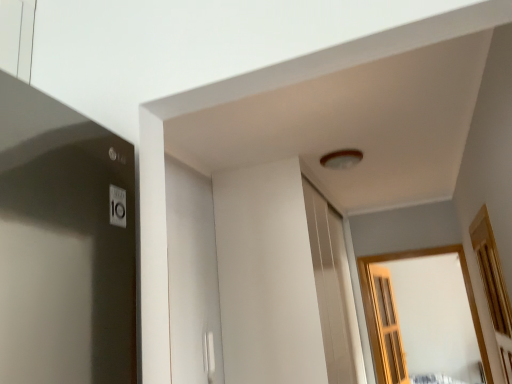
What do you see at coordinates (387, 325) in the screenshot? The height and width of the screenshot is (384, 512). I see `wooden screen door at right` at bounding box center [387, 325].

Identify the location of wooden screen door at right. (387, 325).

The image size is (512, 384). I want to click on wooden-framed window at center, which is the 1th window in back-to-front order, so click(377, 310).

This screenshot has height=384, width=512. What are the coordinates of `window that is the 1st object located in front of the wooden screen door at right` in the screenshot? It's located at pyautogui.click(x=377, y=310).

From a real-world perspective, is wooden screen door at right physically located above or below wooden-framed window at center, the 2th window positioned from the front?

wooden screen door at right is below wooden-framed window at center, the 2th window positioned from the front.

Which object is further away from the camera taking this photo, wooden screen door at right or wooden-framed window at center, the 2th window positioned from the front?

wooden screen door at right is behind.

From the image's perspective, which one is positioned higher, wooden at right, placed as the first window when sorted from front to back, or wooden screen door at right?

wooden at right, placed as the first window when sorted from front to back, from the image's perspective.

In the scene shown: From a real-world perspective, which object stands above the other?

wooden at right, placed as the first window when sorted from front to back, is physically above.

Considering the positions of objects wooden at right, the second window from the back, and wooden screen door at right in the image provided, who is behind, wooden at right, the second window from the back, or wooden screen door at right?

wooden screen door at right.

In the scene shown: Is wooden at right, placed as the first window when sorted from front to back, thinner than wooden screen door at right?

Yes.

In the scene shown: Can you confirm if wooden screen door at right is thinner than wooden at right, placed as the first window when sorted from front to back?

Incorrect, the width of wooden screen door at right is not less than that of wooden at right, placed as the first window when sorted from front to back.

From the image's perspective, is wooden screen door at right below wooden at right, placed as the first window when sorted from front to back?

Correct, wooden screen door at right appears lower than wooden at right, placed as the first window when sorted from front to back, in the image.

Locate an element on the screen. This screenshot has width=512, height=384. the 2nd window in front of the wooden screen door at right, counting from the anchor's position is located at coordinates (493, 287).

How many degrees apart are the facing directions of wooden screen door at right and wooden at right, the second window from the back?

wooden screen door at right and wooden at right, the second window from the back, are facing 171 degrees away from each other.

Between wooden at right, placed as the first window when sorted from front to back, and wooden-framed window at center, which is the 1th window in back-to-front order, which one is positioned in front?

wooden at right, placed as the first window when sorted from front to back, is closer to the camera.

From the picture: From a real-world perspective, who is located higher, wooden at right, placed as the first window when sorted from front to back, or wooden-framed window at center, which is the 1th window in back-to-front order?

wooden at right, placed as the first window when sorted from front to back, from a real-world perspective.

Based on their sizes in the image, would you say wooden at right, placed as the first window when sorted from front to back, is bigger or smaller than wooden-framed window at center, which is the 1th window in back-to-front order?

Clearly, wooden at right, placed as the first window when sorted from front to back, is smaller in size than wooden-framed window at center, which is the 1th window in back-to-front order.

Is wooden at right, placed as the first window when sorted from front to back, wider or thinner than wooden-framed window at center, which is the 1th window in back-to-front order?

In the image, wooden at right, placed as the first window when sorted from front to back, appears to be more narrow than wooden-framed window at center, which is the 1th window in back-to-front order.

Is wooden-framed window at center, the 2th window positioned from the front, inside or outside of wooden screen door at right?

wooden-framed window at center, the 2th window positioned from the front, lies outside wooden screen door at right.

Which of these two, wooden-framed window at center, the 2th window positioned from the front, or wooden screen door at right, is smaller?

wooden screen door at right.

In the scene shown: From the image's perspective, which is below, wooden-framed window at center, the 2th window positioned from the front, or wooden screen door at right?

wooden screen door at right, from the image's perspective.

Which point is more distant from viewer, (381, 356) or (374, 314)?

The point (374, 314) is more distant.

Can you confirm if wooden-framed window at center, the 2th window positioned from the front, is shorter than wooden at right, placed as the first window when sorted from front to back?

No.

From a real-world perspective, between wooden-framed window at center, the 2th window positioned from the front, and wooden at right, the second window from the back, who is vertically higher?

wooden at right, the second window from the back, is physically above.

Is wooden-framed window at center, which is the 1th window in back-to-front order, at the left side of wooden at right, the second window from the back?

Incorrect, wooden-framed window at center, which is the 1th window in back-to-front order, is not on the left side of wooden at right, the second window from the back.

Looking at this image, is wooden-framed window at center, which is the 1th window in back-to-front order, in front of or behind wooden at right, placed as the first window when sorted from front to back, in the image?

In the image, wooden-framed window at center, which is the 1th window in back-to-front order, appears behind wooden at right, placed as the first window when sorted from front to back.

Find the location of a particular element. This screenshot has height=384, width=512. screen door that is under the wooden-framed window at center, which is the 1th window in back-to-front order (from a real-world perspective) is located at coordinates (387, 325).

At what (x,y) coordinates should I click in order to perform the action: click on the 1st window to the right of the wooden screen door at right, counting from the anchor's position. Please return your answer as a coordinate pair (x, y). The image size is (512, 384). Looking at the image, I should click on (493, 287).

Based on their spatial positions, is wooden-framed window at center, which is the 1th window in back-to-front order, or wooden screen door at right closer to wooden at right, placed as the first window when sorted from front to back?

The object closer to wooden at right, placed as the first window when sorted from front to back, is wooden-framed window at center, which is the 1th window in back-to-front order.

When comparing their distances from wooden screen door at right, does wooden-framed window at center, the 2th window positioned from the front, or wooden at right, placed as the first window when sorted from front to back, seem further?

Among the two, wooden at right, placed as the first window when sorted from front to back, is located further to wooden screen door at right.

Based on their spatial positions, is wooden screen door at right or wooden at right, placed as the first window when sorted from front to back, further from wooden-framed window at center, which is the 1th window in back-to-front order?

The object further to wooden-framed window at center, which is the 1th window in back-to-front order, is wooden at right, placed as the first window when sorted from front to back.

From the picture: From the image, which object appears to be nearer to wooden at right, the second window from the back, wooden screen door at right or wooden-framed window at center, the 2th window positioned from the front?

Based on the image, wooden-framed window at center, the 2th window positioned from the front, appears to be nearer to wooden at right, the second window from the back.

Looking at the image, which one is located further to wooden-framed window at center, the 2th window positioned from the front, wooden at right, the second window from the back, or wooden screen door at right?

wooden at right, the second window from the back.

When comparing their distances from wooden screen door at right, does wooden at right, the second window from the back, or wooden-framed window at center, which is the 1th window in back-to-front order, seem further?

Among the two, wooden at right, the second window from the back, is located further to wooden screen door at right.

The width and height of the screenshot is (512, 384). I want to click on window between wooden at right, placed as the first window when sorted from front to back, and wooden screen door at right, along the z-axis, so click(x=377, y=310).